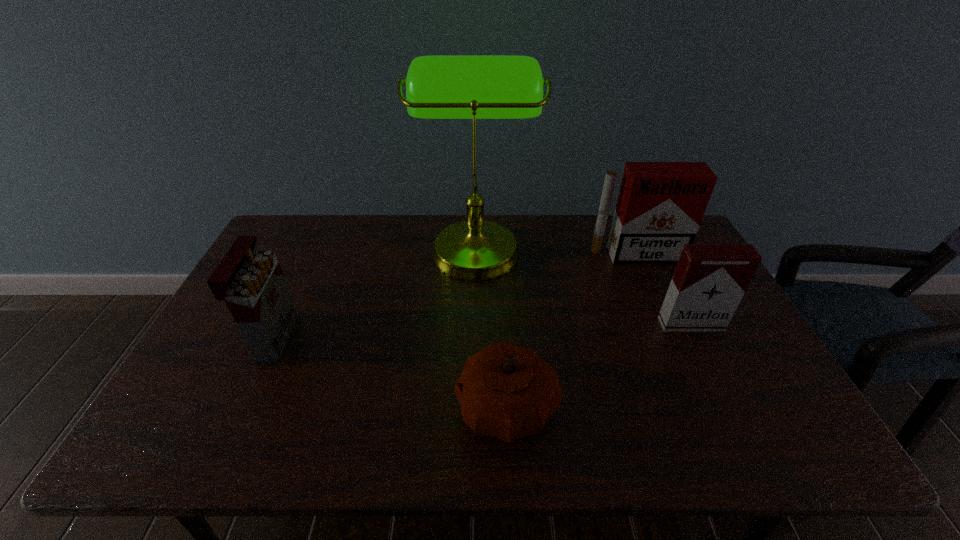
Identify the location of lamp. (474, 87).

At what (x,y) coordinates should I click in order to perform the action: click on the farthest cigarette_case. Please return your answer as a coordinate pair (x, y). The image size is (960, 540). Looking at the image, I should click on (660, 206).

Find the location of a particular element. This screenshot has width=960, height=540. the leftmost object is located at coordinates (251, 282).

This screenshot has height=540, width=960. In order to click on the nearest object in this screenshot , I will do `click(506, 391)`.

Find the location of a particular element. This screenshot has height=540, width=960. pumpkin is located at coordinates (506, 391).

Identify the location of blank space located on the desk next to the lamp. The height and width of the screenshot is (540, 960). (620, 246).

Where is `vacant position located 0.200m on the front-facing side of the farthest cigarette_case`? This screenshot has width=960, height=540. vacant position located 0.200m on the front-facing side of the farthest cigarette_case is located at coordinates coord(659,308).

Find the location of a particular element. Image resolution: width=960 pixels, height=540 pixels. free space located with the lid open on the leftmost cigarette_case is located at coordinates (370, 336).

Find the location of a particular element. Image resolution: width=960 pixels, height=540 pixels. free space located 0.360m on the front-facing side of the nearest object is located at coordinates (301, 407).

You are a GUI agent. You are given a task and a screenshot of the screen. Output one action in this format:
    pyautogui.click(x=<x>, y=<y>)
    Task: Click on the vacant space located 0.210m on the front-facing side of the nearest object
    The image size is (960, 540).
    Given the screenshot: What is the action you would take?
    pyautogui.click(x=366, y=407)